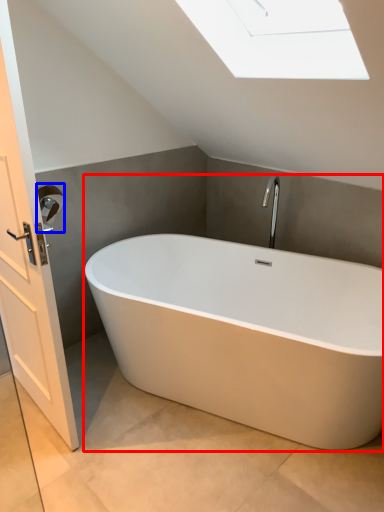
Question: Which point is further to the camera, bathtub (highlighted by a red box) or towel bar (highlighted by a blue box)?

Choices:
 (A) bathtub
 (B) towel bar

Answer: (B)